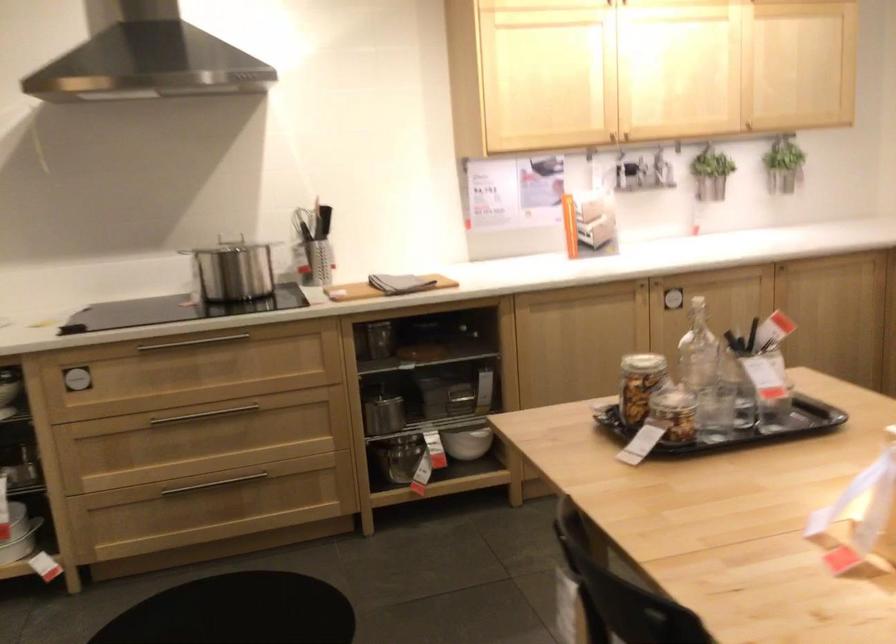
Image resolution: width=896 pixels, height=644 pixels. In order to click on pot lid handle in this screenshot , I will do `click(229, 236)`.